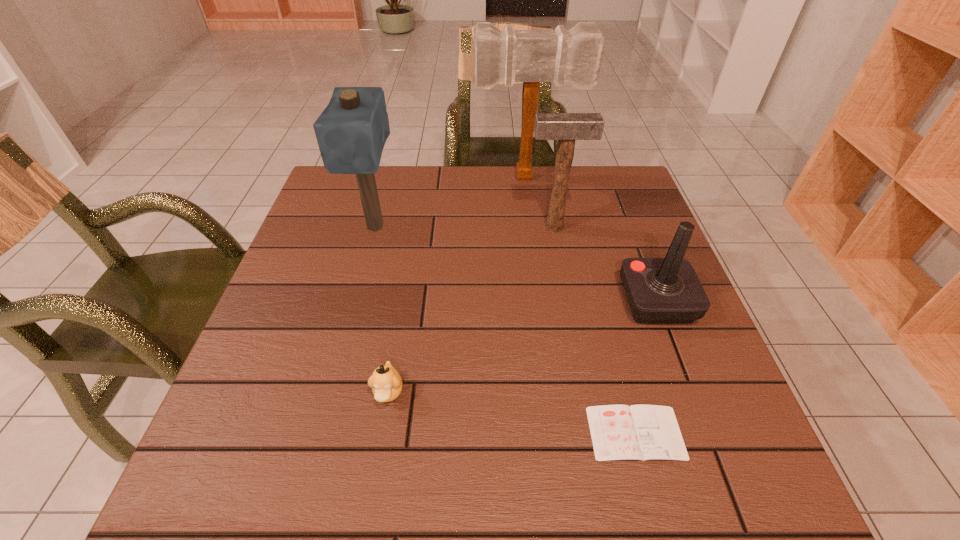
You are a GUI agent. You are given a task and a screenshot of the screen. Output one action in this format:
    pyautogui.click(x=<x>, y=<y>)
    Task: Click on the free space located 0.050m on the left of the leftmost object
    This screenshot has height=540, width=960.
    Given the screenshot: What is the action you would take?
    pyautogui.click(x=335, y=228)

Locate an element on the screen. The image size is (960, 540). free spot located 0.300m on the left of the third tallest object is located at coordinates (412, 226).

I want to click on free space located 0.320m on the back of the joystick, so click(617, 197).

Where is `blank space located on the face of the second shortest object`? This screenshot has width=960, height=540. blank space located on the face of the second shortest object is located at coordinates (380, 441).

This screenshot has width=960, height=540. Identify the location of vacant space located on the back of the diary. (610, 332).

Where is `object present at the near edge`? This screenshot has width=960, height=540. object present at the near edge is located at coordinates (619, 432).

Where is `object located in the left edge section of the desktop`? The image size is (960, 540). object located in the left edge section of the desktop is located at coordinates (351, 132).

Locate an element on the screen. Image resolution: width=960 pixels, height=540 pixels. joystick that is at the right edge is located at coordinates (667, 290).

Locate an element on the screen. diary that is at the right edge is located at coordinates (619, 432).

Where is `object at the far left corner`? The width and height of the screenshot is (960, 540). object at the far left corner is located at coordinates (351, 132).